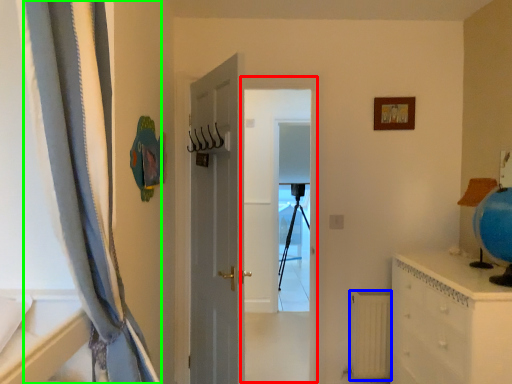
Question: Based on their relative distances, which object is farther from screen door (highlighted by a red box)? Choose from radiator (highlighted by a blue box) and curtain (highlighted by a green box).

Choices:
 (A) radiator
 (B) curtain

Answer: (B)